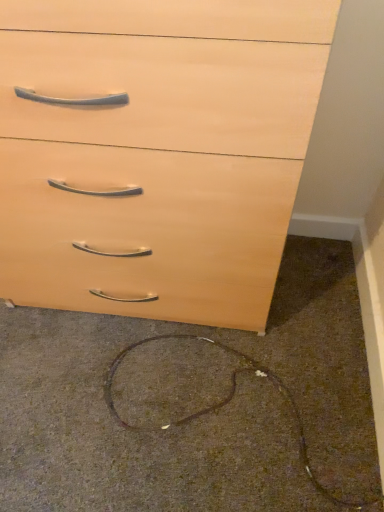
Image resolution: width=384 pixels, height=512 pixels. I want to click on space that is in front of light wood/finish chest of drawers at upper center, so click(x=148, y=409).